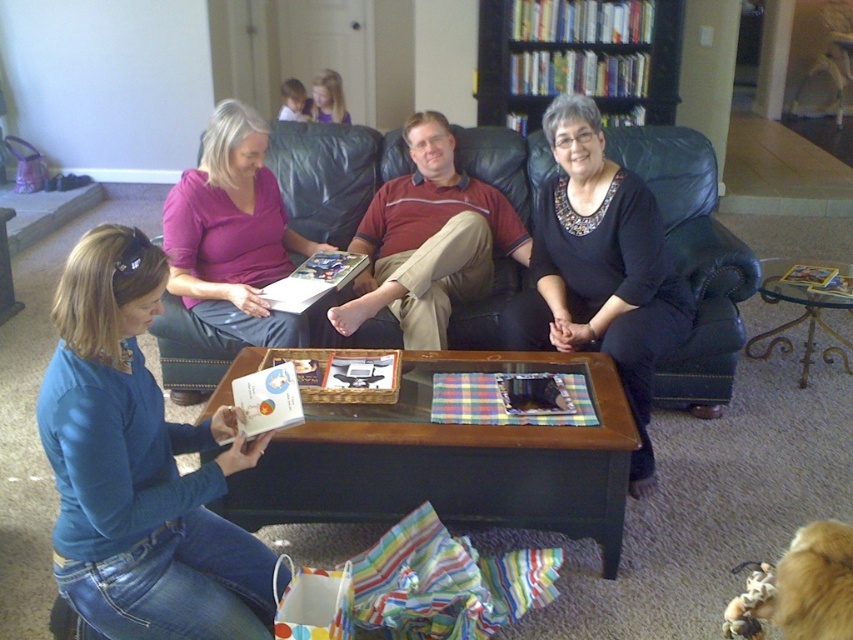
Is black matte dress at center positioned at the back of black wood bookshelf at upper center?

No, black matte dress at center is in front of black wood bookshelf at upper center.

Between black matte dress at center and black wood bookshelf at upper center, which one appears on the right side from the viewer's perspective?

black wood bookshelf at upper center

You are a GUI agent. You are given a task and a screenshot of the screen. Output one action in this format:
    pyautogui.click(x=<x>, y=<y>)
    Task: Click on the black matte dress at center
    The width and height of the screenshot is (853, 640).
    Given the screenshot: What is the action you would take?
    pyautogui.click(x=601, y=268)

You are a GUI agent. You are given a task and a screenshot of the screen. Output one action in this format:
    pyautogui.click(x=<x>, y=<y>)
    Task: Click on the black matte dress at center
    Image resolution: width=853 pixels, height=640 pixels.
    Given the screenshot: What is the action you would take?
    pyautogui.click(x=601, y=268)

Who is taller, leather couch at center or black matte dress at center?

Standing taller between the two is black matte dress at center.

Between point (494, 342) and point (550, 264), which one is positioned in front?

Point (550, 264) is in front.

Measure the distance between leather couch at center and camera.

A distance of 2.75 meters exists between leather couch at center and camera.

You are a GUI agent. You are given a task and a screenshot of the screen. Output one action in this format:
    pyautogui.click(x=<x>, y=<y>)
    Task: Click on the leather couch at center
    The image size is (853, 640).
    Given the screenshot: What is the action you would take?
    pyautogui.click(x=693, y=259)

Which of these two, blue denim jeans at lower left or black matte dress at center, stands taller?

With more height is black matte dress at center.

Does blue denim jeans at lower left have a greater height compared to black matte dress at center?

In fact, blue denim jeans at lower left may be shorter than black matte dress at center.

Where is `blue denim jeans at lower left`? The height and width of the screenshot is (640, 853). blue denim jeans at lower left is located at coordinates (138, 467).